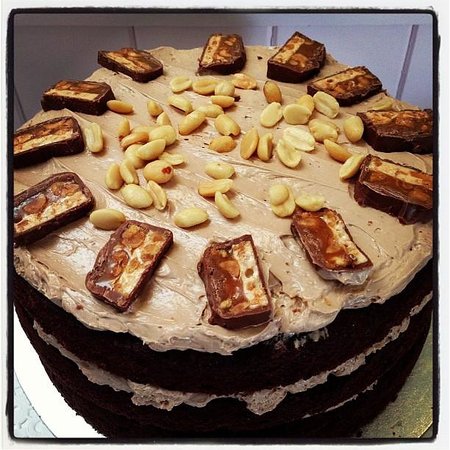
In order to click on silver cake plate in lower left corner in this screenshot , I will do `click(56, 414)`.